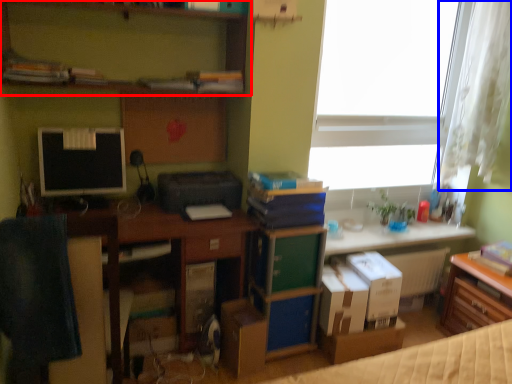
Question: Among these objects, which one is nearest to the camera, shelf (highlighted by a red box) or curtain (highlighted by a blue box)?

Choices:
 (A) shelf
 (B) curtain

Answer: (A)